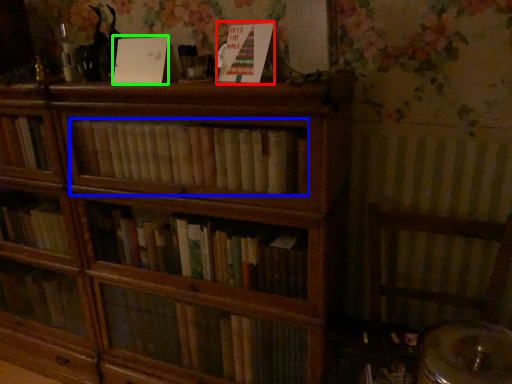
Question: Which is farther away from paperback book (highlighted by a red box)? book (highlighted by a blue box) or paperback book (highlighted by a green box)?

Choices:
 (A) book
 (B) paperback book

Answer: (A)